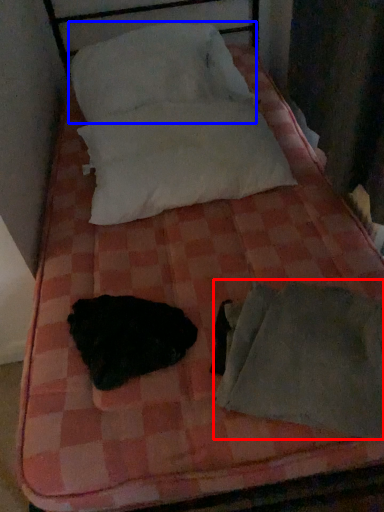
Question: Which object is closer to the camera taking this photo, sleeping bag (highlighted by a red box) or pillow (highlighted by a blue box)?

Choices:
 (A) sleeping bag
 (B) pillow

Answer: (A)